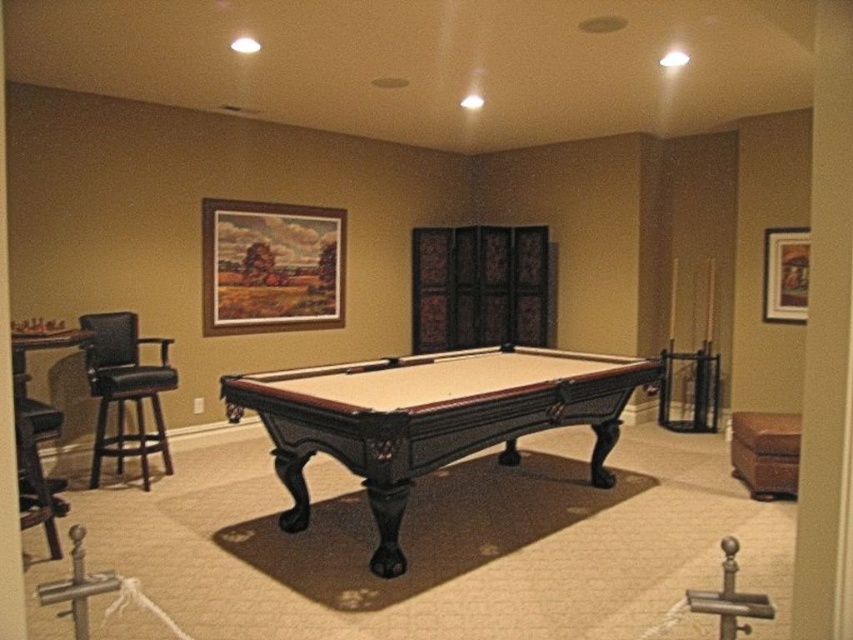
Can you confirm if wooden framed painting at upper center is positioned to the left of brown leather ottoman at lower right?

Indeed, wooden framed painting at upper center is positioned on the left side of brown leather ottoman at lower right.

Who is more distant from viewer, (267, 266) or (747, 474)?

Point (267, 266)

The image size is (853, 640). I want to click on wooden framed painting at upper center, so click(270, 266).

Is mahogany wood pool table at center to the right of wooden picture frame at upper right from the viewer's perspective?

In fact, mahogany wood pool table at center is to the left of wooden picture frame at upper right.

Describe the element at coordinates (428, 419) in the screenshot. I see `mahogany wood pool table at center` at that location.

Locate an element on the screen. The width and height of the screenshot is (853, 640). mahogany wood pool table at center is located at coordinates (428, 419).

Between mahogany wood pool table at center and brown leather ottoman at lower right, which one appears on the right side from the viewer's perspective?

brown leather ottoman at lower right is more to the right.

Find the location of a particular element. This screenshot has width=853, height=640. mahogany wood pool table at center is located at coordinates (428, 419).